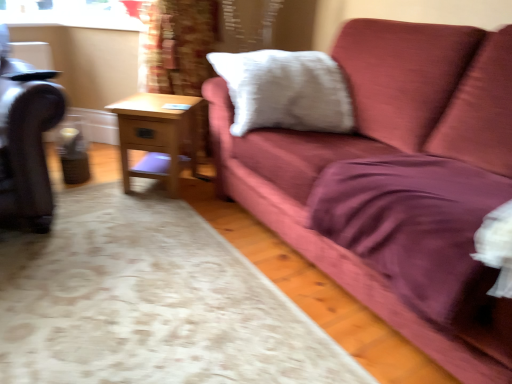
Question: From the image's perspective, is leather swivel chair at left beneath white soft pillow at upper center?

Choices:
 (A) yes
 (B) no

Answer: (A)

Question: Is leather swivel chair at left facing towards white soft pillow at upper center?

Choices:
 (A) no
 (B) yes

Answer: (A)

Question: Is leather swivel chair at left facing away from white soft pillow at upper center?

Choices:
 (A) yes
 (B) no

Answer: (B)

Question: Is leather swivel chair at left far away from white soft pillow at upper center?

Choices:
 (A) yes
 (B) no

Answer: (B)

Question: Does leather swivel chair at left have a lesser width compared to white soft pillow at upper center?

Choices:
 (A) no
 (B) yes

Answer: (A)

Question: From a real-world perspective, is leather swivel chair at left beneath white soft pillow at upper center?

Choices:
 (A) no
 (B) yes

Answer: (B)

Question: Considering the relative positions of white soft pillow at upper center and wooden side table at center in the image provided, is white soft pillow at upper center to the left of wooden side table at center from the viewer's perspective?

Choices:
 (A) yes
 (B) no

Answer: (B)

Question: Does white soft pillow at upper center have a smaller size compared to wooden side table at center?

Choices:
 (A) yes
 (B) no

Answer: (B)

Question: Can you confirm if white soft pillow at upper center is taller than wooden side table at center?

Choices:
 (A) yes
 (B) no

Answer: (A)

Question: Is white soft pillow at upper center located outside wooden side table at center?

Choices:
 (A) yes
 (B) no

Answer: (A)

Question: Is wooden side table at center a part of white soft pillow at upper center?

Choices:
 (A) no
 (B) yes

Answer: (A)

Question: Does white soft pillow at upper center lie behind wooden side table at center?

Choices:
 (A) yes
 (B) no

Answer: (B)

Question: From the image's perspective, is wooden side table at center under leather swivel chair at left?

Choices:
 (A) no
 (B) yes

Answer: (B)